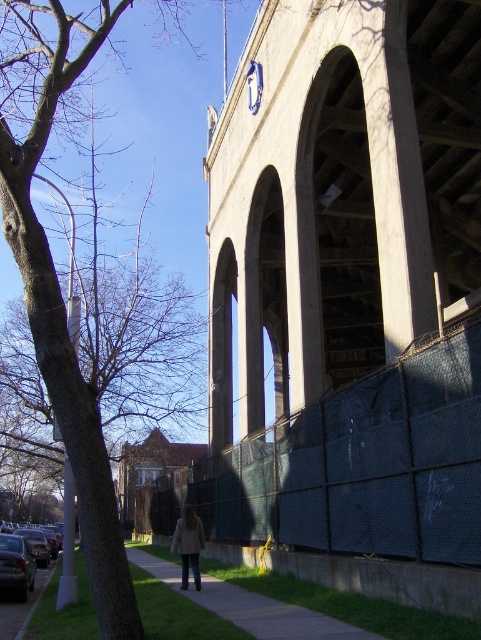
The width and height of the screenshot is (481, 640). Describe the element at coordinates (54, 269) in the screenshot. I see `brown leafless tree at left` at that location.

Who is more distant from viewer, (25,282) or (235,584)?

The point (235,584) is more distant.

At what (x,y) coordinates should I click in order to perform the action: click on brown leafless tree at left. Please return your answer as a coordinate pair (x, y). Looking at the image, I should click on (54, 269).

Is concrete/stone bridge at center positioned at the back of brown leafless tree at left?

Yes.

Does concrete/stone bridge at center have a smaller size compared to brown leafless tree at left?

Yes, concrete/stone bridge at center is smaller than brown leafless tree at left.

Where is `concrete/stone bridge at center`? The image size is (481, 640). concrete/stone bridge at center is located at coordinates (345, 244).

Which is in front, point (280, 241) or point (334, 636)?

Point (334, 636) is in front.

Based on the photo, who is positioned more to the right, concrete/stone bridge at center or concrete sidewalk at lower center?

Positioned to the right is concrete/stone bridge at center.

In order to click on concrete/stone bridge at center in this screenshot , I will do `click(345, 244)`.

The width and height of the screenshot is (481, 640). In order to click on concrete/stone bridge at center in this screenshot , I will do `click(345, 244)`.